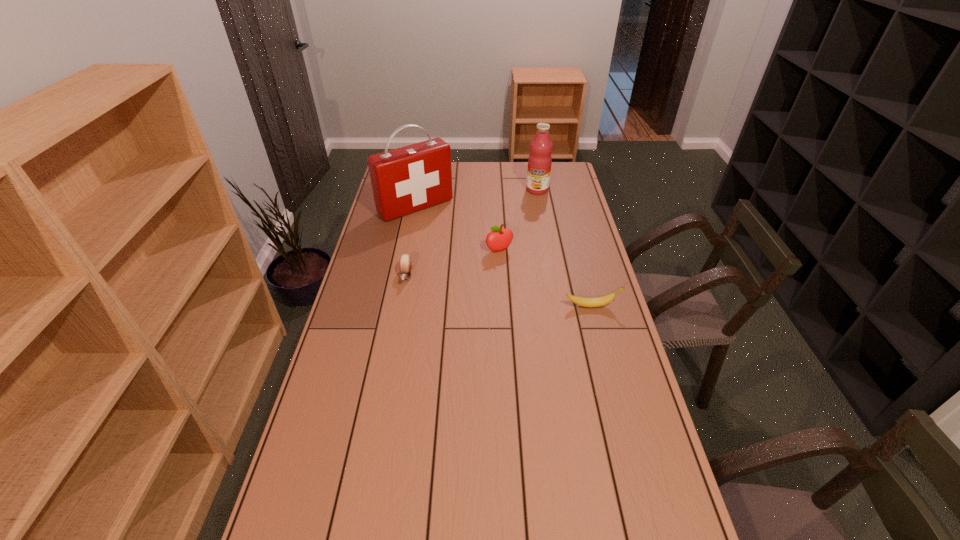
Where is `the first-aid kit present at the left edge`? the first-aid kit present at the left edge is located at coordinates (408, 179).

I want to click on banana that is positioned at the right edge, so click(599, 301).

Identify the location of fruit juice at the right edge. This screenshot has width=960, height=540. (539, 162).

Image resolution: width=960 pixels, height=540 pixels. Find the location of `object situated at the far right corner`. object situated at the far right corner is located at coordinates (539, 162).

This screenshot has height=540, width=960. I want to click on free spot at the far edge of the desktop, so click(522, 178).

This screenshot has width=960, height=540. I want to click on free space at the left edge of the desktop, so click(350, 298).

The width and height of the screenshot is (960, 540). What are the coordinates of `vacant point at the right edge` in the screenshot? It's located at (574, 187).

Image resolution: width=960 pixels, height=540 pixels. I want to click on vacant space that is in between the nearest object and the fruit juice, so click(x=564, y=248).

Find the location of a particular element. This screenshot has height=540, width=960. free space that is in between the escargot and the banana is located at coordinates (499, 291).

You are a GUI agent. You are given a task and a screenshot of the screen. Output one action in this format:
    pyautogui.click(x=<x>, y=<y>)
    Task: Click on the free area in between the fruit juice and the escargot
    The height and width of the screenshot is (540, 960).
    Given the screenshot: What is the action you would take?
    (x=471, y=233)